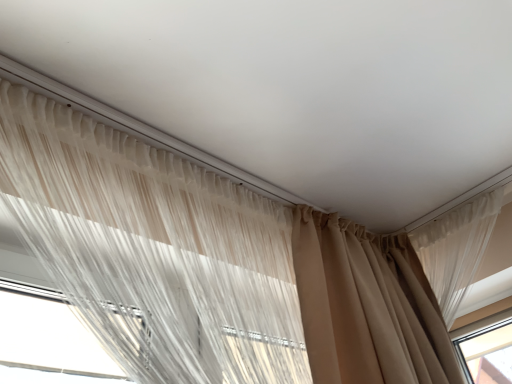
At what (x,y) coordinates should I click in order to perform the action: click on beige fabric curtain at upper right. Please return your answer as a coordinate pair (x, y). This screenshot has width=512, height=384. Looking at the image, I should click on (457, 248).

Image resolution: width=512 pixels, height=384 pixels. What do you see at coordinates (457, 248) in the screenshot?
I see `beige fabric curtain at upper right` at bounding box center [457, 248].

Where is `beige fabric curtain at upper right`? beige fabric curtain at upper right is located at coordinates (457, 248).